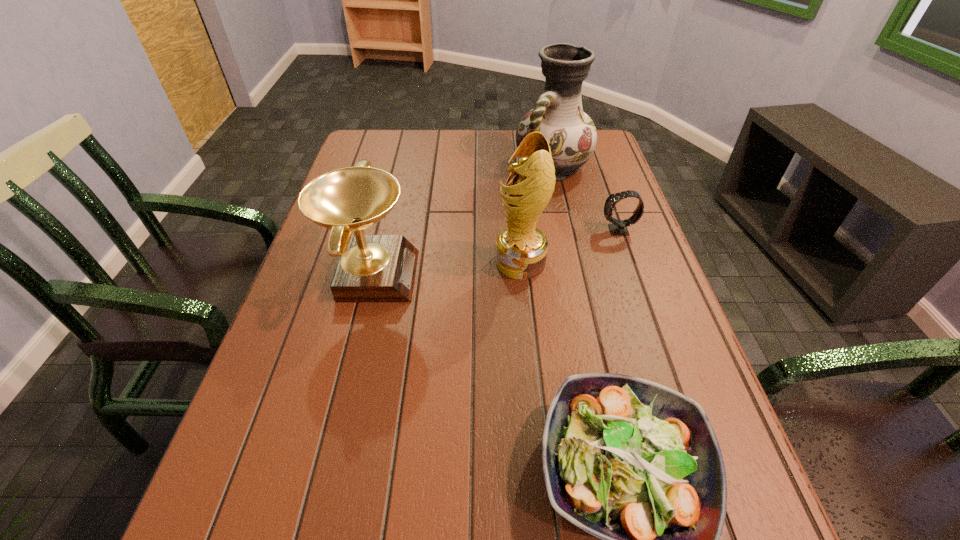
Find the location of a particular element. This screenshot has width=960, height=540. the farthest object is located at coordinates (558, 114).

I want to click on the taller award, so 521,249.

Where is `the left award`? This screenshot has width=960, height=540. the left award is located at coordinates (371, 268).

I want to click on the shorter award, so tap(371, 268).

At what (x,y) coordinates should I click in order to perform the action: click on watch. Please return your answer as a coordinate pair (x, y). The height and width of the screenshot is (540, 960). Looking at the image, I should click on (618, 227).

Where is `free space located 0.320m on the left of the vase`? This screenshot has width=960, height=540. free space located 0.320m on the left of the vase is located at coordinates (411, 166).

The width and height of the screenshot is (960, 540). I want to click on vacant space located 0.240m on the front-facing side of the taller award, so click(396, 262).

The width and height of the screenshot is (960, 540). What are the coordinates of `vacant region located on the front-facing side of the taller award` in the screenshot? It's located at (412, 262).

Identify the location of vacant space situated 0.170m on the front-facing side of the taller award. (424, 262).

Where is `free space located on the front-facing side of the leftmost object`? free space located on the front-facing side of the leftmost object is located at coordinates (540, 274).